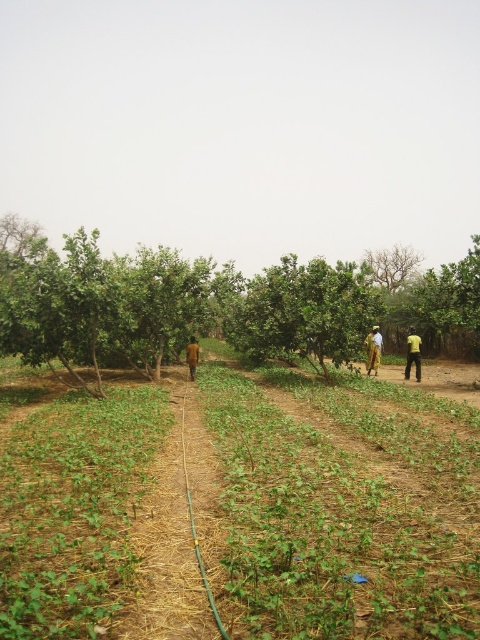
Question: Can you confirm if green leafy tree at center is positioned to the left of yellow fabric dress at right?

Choices:
 (A) yes
 (B) no

Answer: (A)

Question: Which object is the closest to the green leafy tree at center?

Choices:
 (A) yellow fabric at right
 (B) brown textured person at center
 (C) yellow fabric dress at right
 (D) green leafy tree at upper center

Answer: (C)

Question: Is yellow fabric dress at right further to camera compared to brown textured person at center?

Choices:
 (A) no
 (B) yes

Answer: (B)

Question: In this image, where is yellow fabric at right located relative to brown textured person at center?

Choices:
 (A) right
 (B) left

Answer: (A)

Question: Which is nearer to the yellow fabric at right?

Choices:
 (A) brown textured person at center
 (B) green leafy tree at upper center
 (C) yellow fabric dress at right
 (D) green leafy tree at center

Answer: (C)

Question: Which point appears closest to the camera in this image?

Choices:
 (A) (189, 344)
 (B) (371, 364)
 (C) (233, 317)
 (D) (409, 340)

Answer: (D)